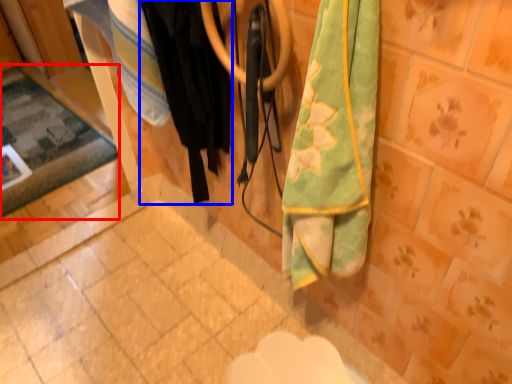
Question: Which point is closer to the camera, mat (highlighted by a red box) or clothing (highlighted by a blue box)?

Choices:
 (A) mat
 (B) clothing

Answer: (B)